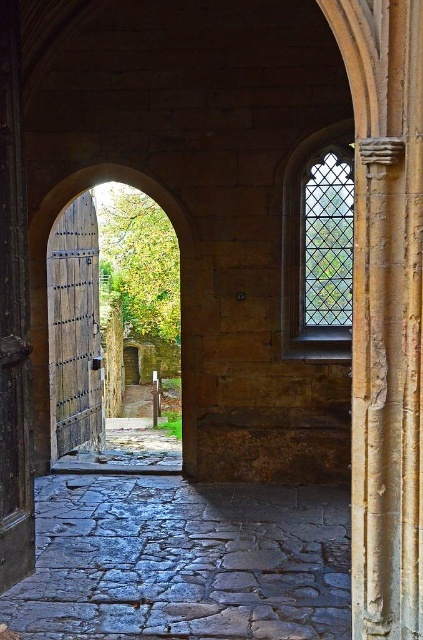
You are an architect visiting this historic stone structure. You need to determine the relative heights of the green stained glass window at upper right and the wooden door at center. Which one is taller?

The wooden door at center is taller than the green stained glass window at upper right.

You are an architect visiting this historic site and need to compare the heights of the green stained glass window at upper right and the wooden gate at center. Which one is taller?

The wooden gate at center is taller than the green stained glass window at upper right.